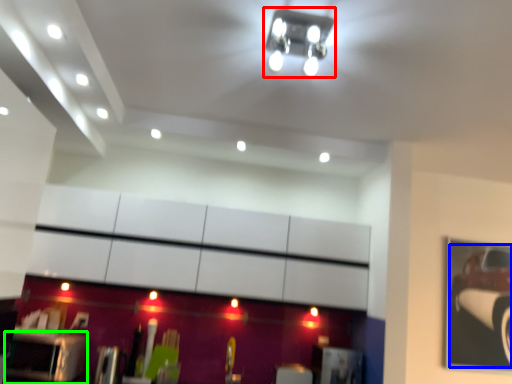
Question: Considering the real-world distances, which object is closest to light fixture (highlighted by a red box)? car (highlighted by a blue box) or furniture (highlighted by a green box).

Choices:
 (A) car
 (B) furniture

Answer: (B)